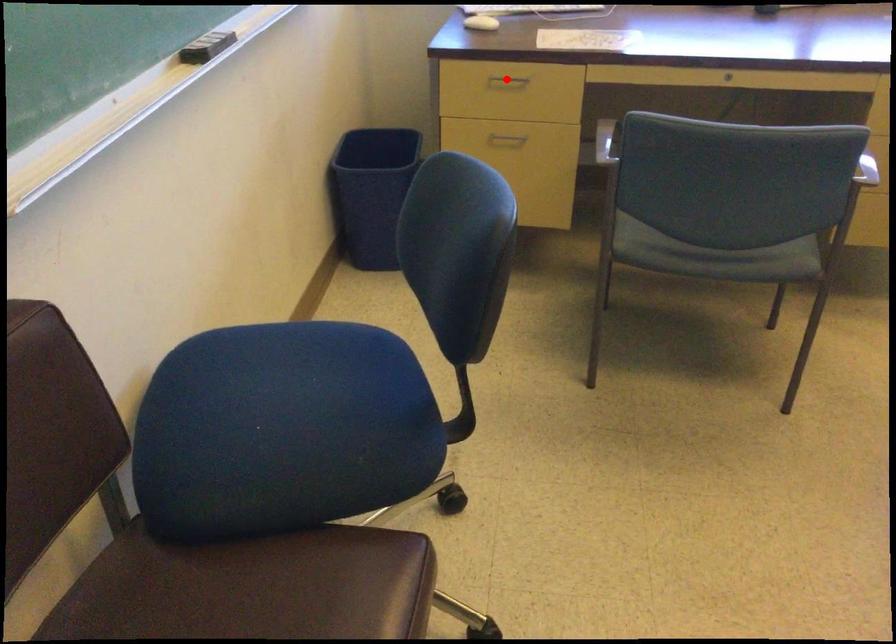
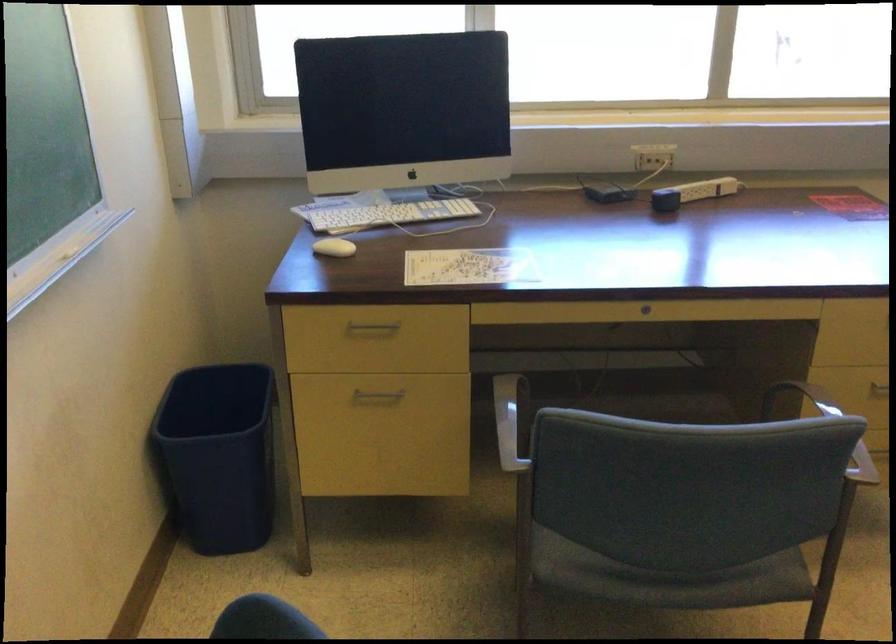
Question: I am providing you with two images of the same scene from different viewpoints. Image1 has a red point marked. In image2, the corresponding 3D location appears at what relative position? Reply with the corresponding letter.

Choices:
 (A) Closer
 (B) Farther

Answer: (A)